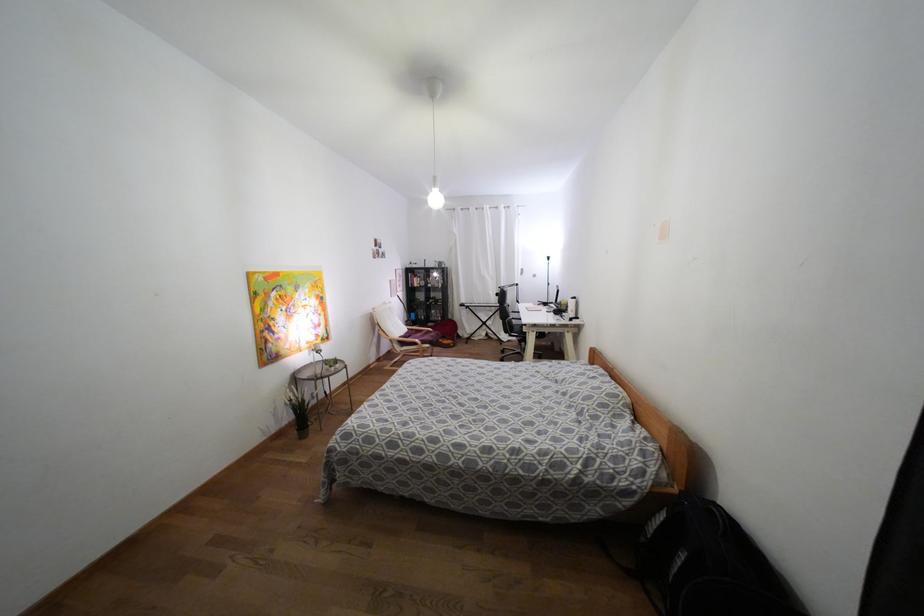
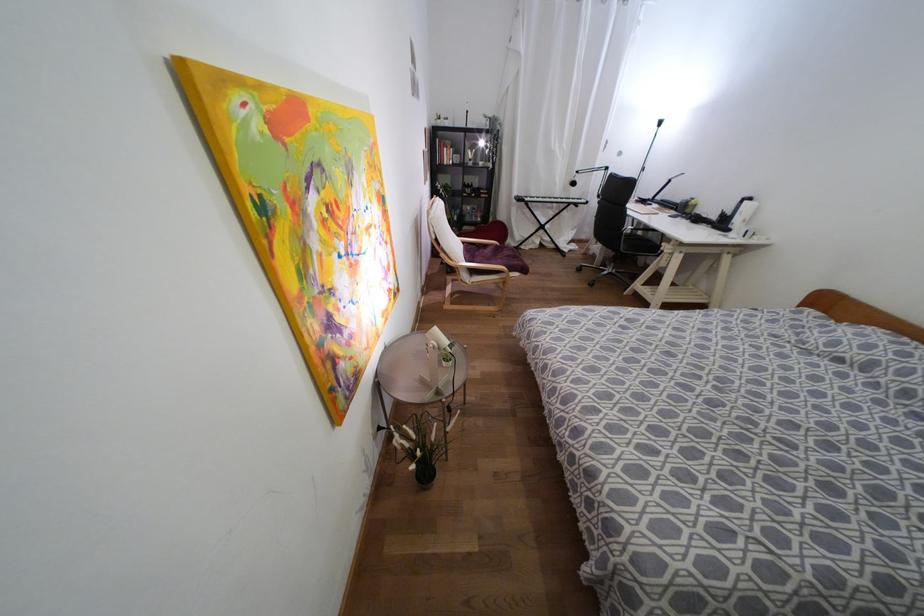
Locate, in the second image, the point that corresponds to the point at 574,297 in the first image.

(749, 198)